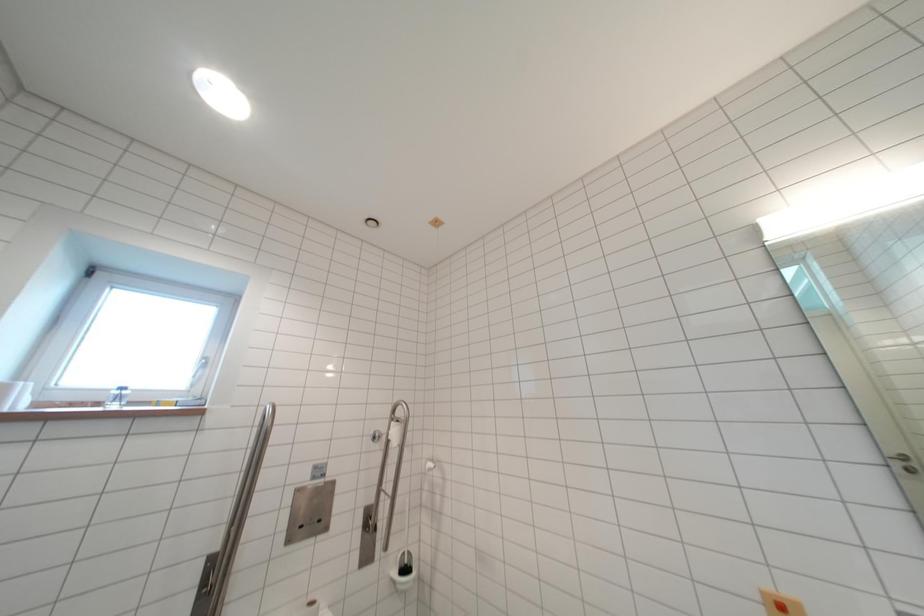
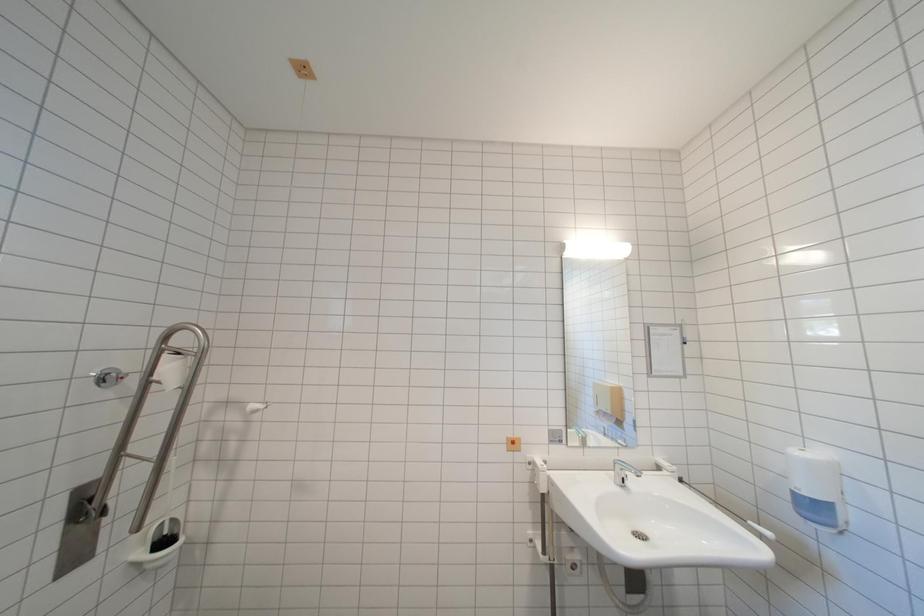
Question: The camera is either moving clockwise (left) or counter-clockwise (right) around the object. The first image is from the beginning of the video and the second image is from the end. Is the camera moving left or right when shooting the video?

Choices:
 (A) Left
 (B) Right

Answer: (A)